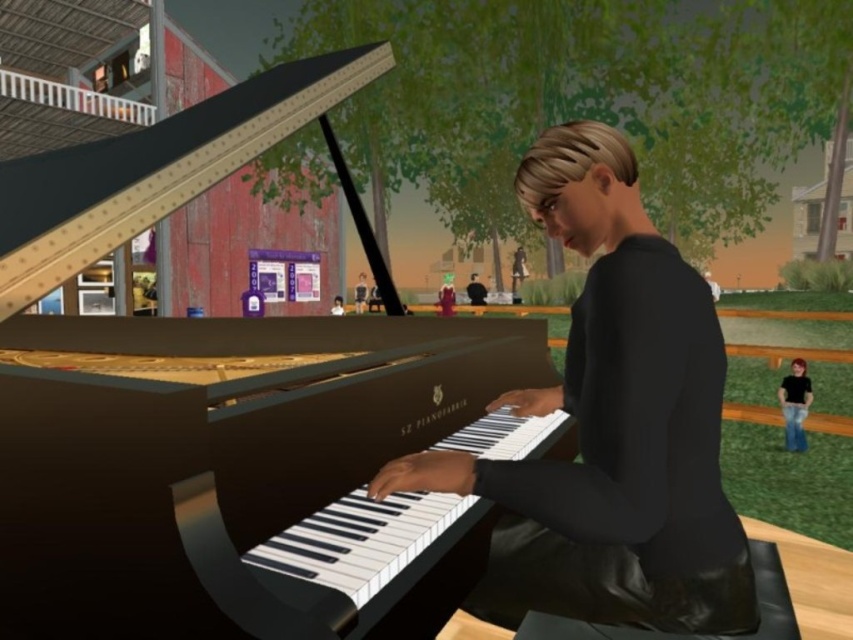
Based on the scene description, where exactly is the shiny polished wood piano at center located in terms of coordinates?

The shiny polished wood piano at center is located at point coordinates of 0.648 and 0.267.

You are a photographer wanting to capture the shiny polished wood piano at center and the matte black shirt at center in a single shot. Which object should you focus on first if you want to ensure both are in focus?

The shiny polished wood piano at center is much taller than the matte black shirt at center, so you should focus on the shiny polished wood piano at center first to ensure both are in focus.